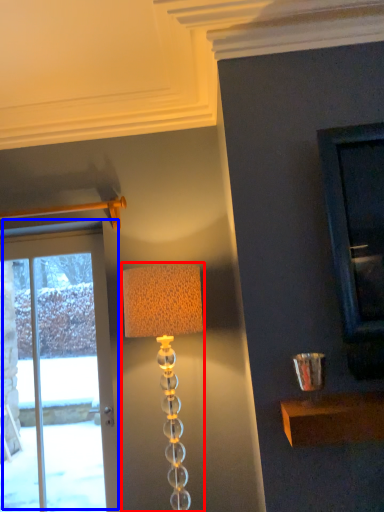
Question: Which of the following is the closest to the observer, lamp (highlighted by a red box) or door (highlighted by a blue box)?

Choices:
 (A) lamp
 (B) door

Answer: (A)